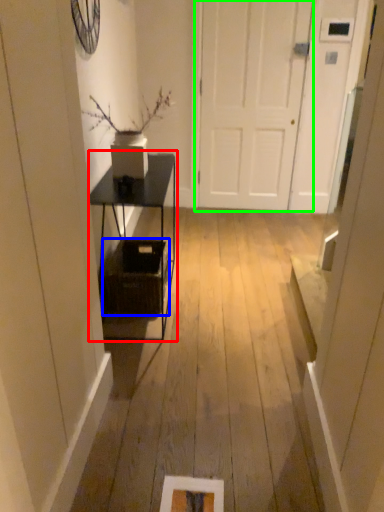
Question: Estimate the real-world distances between objects in this image. Which object is farther from table (highlighted by a red box), basket (highlighted by a blue box) or door (highlighted by a green box)?

Choices:
 (A) basket
 (B) door

Answer: (B)